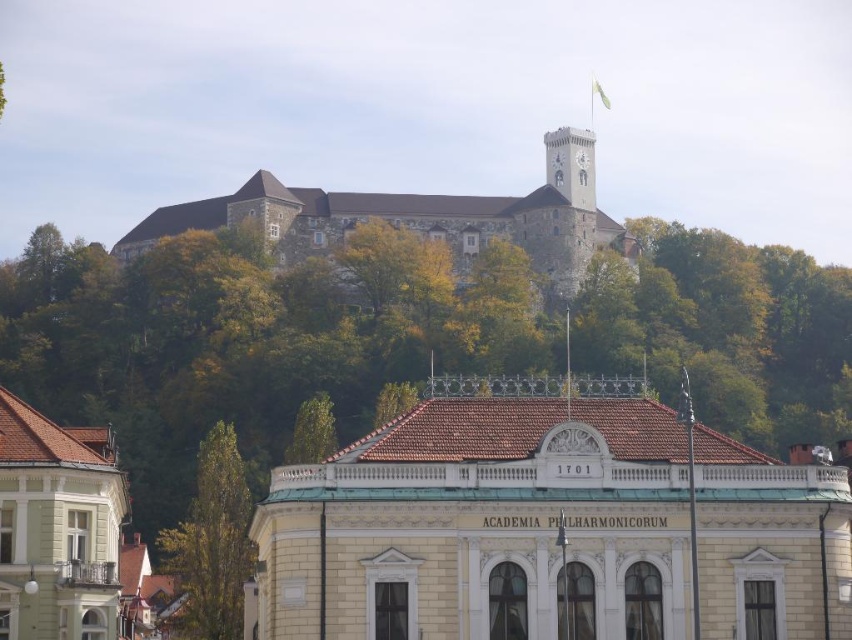
Which is below, green leafy tree at lower left or light gray stone clock tower at upper center?

green leafy tree at lower left

Is green leafy tree at lower left further to the viewer compared to light gray stone clock tower at upper center?

No, it is not.

Is point (242, 618) closer to camera compared to point (574, 148)?

Yes, point (242, 618) is in front of point (574, 148).

I want to click on green leafy tree at lower left, so click(x=213, y=541).

What do you see at coordinates (213, 541) in the screenshot?
I see `green leafy tree at lower left` at bounding box center [213, 541].

Who is positioned more to the left, green leafy tree at lower left or green leafy tree at upper center?

green leafy tree at lower left

Is point (185, 625) less distant than point (324, 448)?

Yes, point (185, 625) is closer to viewer.

I want to click on green leafy tree at lower left, so click(x=213, y=541).

Does brown stone castle at upper center have a smaller size compared to green leafy tree at upper center?

Incorrect, brown stone castle at upper center is not smaller in size than green leafy tree at upper center.

Between brown stone castle at upper center and green leafy tree at upper center, which one is positioned lower?

green leafy tree at upper center is lower down.

The image size is (852, 640). Identify the location of brown stone castle at upper center. (400, 225).

You are a GUI agent. You are given a task and a screenshot of the screen. Output one action in this format:
    pyautogui.click(x=<x>, y=<y>)
    Task: Click on the brown stone castle at upper center
    The height and width of the screenshot is (640, 852).
    Given the screenshot: What is the action you would take?
    pyautogui.click(x=400, y=225)